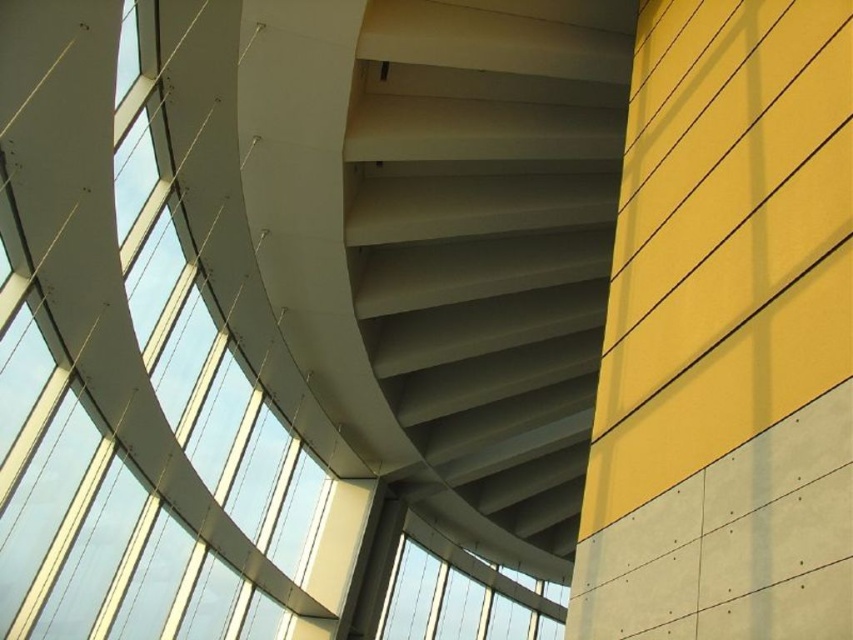
Question: Which of the following is the farthest from the observer?

Choices:
 (A) smooth concrete stairs at center
 (B) transparent glass window at center

Answer: (B)

Question: Is smooth concrete stairs at center positioned in front of transparent glass window at center?

Choices:
 (A) no
 (B) yes

Answer: (B)

Question: Where is smooth concrete stairs at center located in relation to transparent glass window at center in the image?

Choices:
 (A) above
 (B) below

Answer: (A)

Question: Does smooth concrete stairs at center have a larger size compared to transparent glass window at center?

Choices:
 (A) no
 (B) yes

Answer: (B)